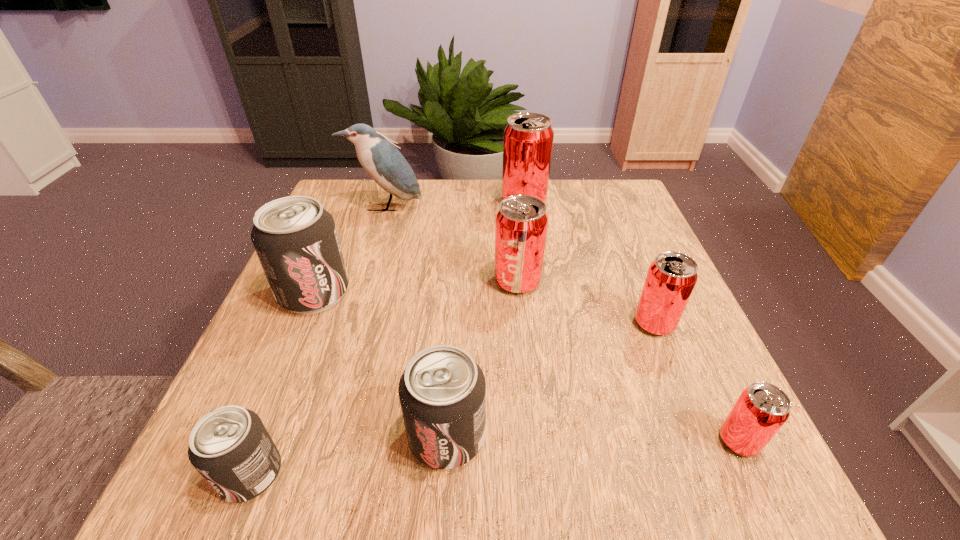
Locate an element on the screen. The height and width of the screenshot is (540, 960). the biggest red soda can is located at coordinates (528, 137).

I want to click on the tallest soda can, so click(528, 137).

I want to click on blue bird, so click(x=383, y=162).

This screenshot has width=960, height=540. I want to click on the third nearest red soda can, so click(521, 223).

Image resolution: width=960 pixels, height=540 pixels. Find the location of `the biggest black soda can`. the biggest black soda can is located at coordinates (295, 238).

Image resolution: width=960 pixels, height=540 pixels. I want to click on the second smallest red soda can, so click(671, 277).

At what (x,y) coordinates should I click in order to perform the action: click on the fourth object from left to right. Please return your answer as a coordinate pair (x, y). Looking at the image, I should click on (442, 391).

You are a GUI agent. You are given a task and a screenshot of the screen. Output one action in this format:
    pyautogui.click(x=<x>, y=<y>)
    Task: Click on the rightmost black soda can
    
    Given the screenshot: What is the action you would take?
    pyautogui.click(x=442, y=391)

Image resolution: width=960 pixels, height=540 pixels. Find the location of `the smallest red soda can`. the smallest red soda can is located at coordinates (761, 410).

You are a GUI agent. You are given a task and a screenshot of the screen. Output one action in this format:
    pyautogui.click(x=<x>, y=<y>)
    Task: Click on the smallest black soda can
    The height and width of the screenshot is (540, 960).
    Given the screenshot: What is the action you would take?
    pyautogui.click(x=230, y=447)